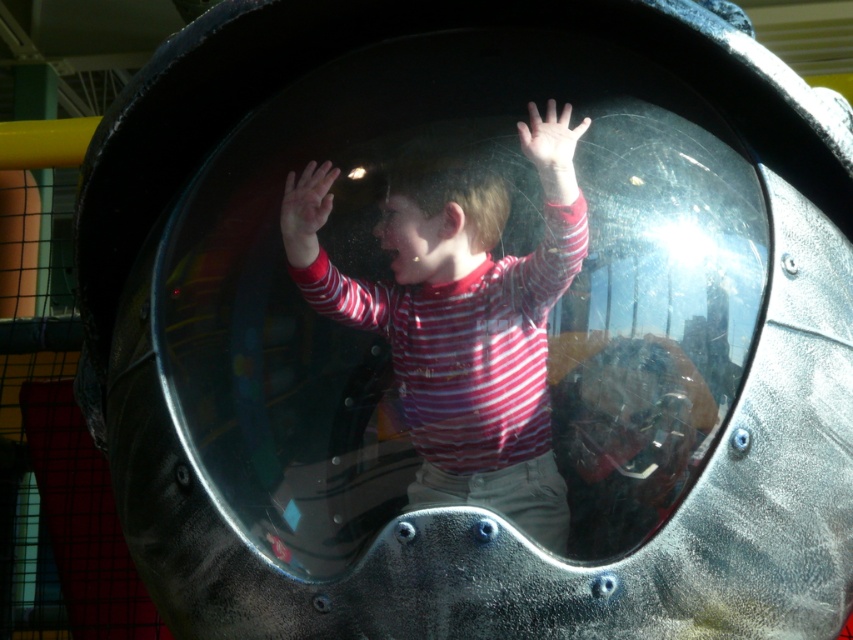
Based on the photo, you are a photographer trying to capture a photo of the striped fabric child at center. Your camera requires a minimum distance of 1.5 meters to focus properly. Based on the scene, can you take a clear photo from your current position?

The striped fabric child at center and camera are 1.26 meters apart. Since the required minimum distance is 1.5 meters, the camera is too close to focus properly. Therefore, you cannot take a clear photo from your current position.

You are a photographer trying to capture the striped fabric child at center and the matte red striped shirt at center in a single shot. Based on their sizes, which one should you focus on first to ensure both are in frame?

The striped fabric child at center is larger in size than the matte red striped shirt at center, so you should focus on the striped fabric child at center first to ensure both fit within the frame.

You are designing a safety barrier for the play structure and need to ensure it accommodates the widest part of the striped fabric child at center and the matte red striped shirt at center. Which one requires the barrier to be wider?

The striped fabric child at center requires the barrier to be wider because its width is larger than the matte red striped shirt at center.